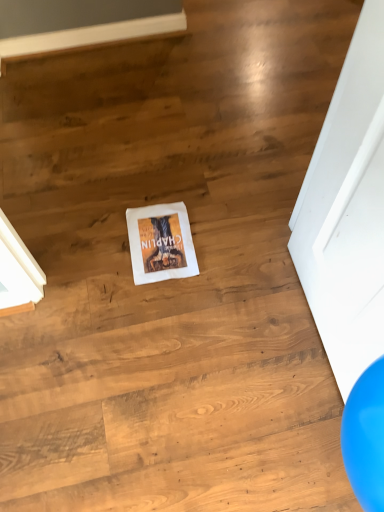
Question: Does white cloth at center have a smaller size compared to white matte door at center?

Choices:
 (A) no
 (B) yes

Answer: (B)

Question: From a real-world perspective, is white cloth at center positioned under white matte door at center based on gravity?

Choices:
 (A) yes
 (B) no

Answer: (A)

Question: Can you confirm if white cloth at center is positioned to the left of white matte door at center?

Choices:
 (A) yes
 (B) no

Answer: (A)

Question: Does white cloth at center have a lesser height compared to white matte door at center?

Choices:
 (A) no
 (B) yes

Answer: (B)

Question: Is white cloth at center facing away from white matte door at center?

Choices:
 (A) no
 (B) yes

Answer: (A)

Question: Is white cloth at center bigger than white matte door at center?

Choices:
 (A) yes
 (B) no

Answer: (B)

Question: From the image's perspective, is white matte door at center below white cloth at center?

Choices:
 (A) no
 (B) yes

Answer: (B)

Question: From a real-world perspective, is white matte door at center under white cloth at center?

Choices:
 (A) yes
 (B) no

Answer: (B)

Question: Does white matte door at center have a lesser height compared to white cloth at center?

Choices:
 (A) yes
 (B) no

Answer: (B)

Question: Can you confirm if white matte door at center is wider than white cloth at center?

Choices:
 (A) no
 (B) yes

Answer: (A)

Question: Are white matte door at center and white cloth at center making contact?

Choices:
 (A) yes
 (B) no

Answer: (B)

Question: Is white matte door at center positioned beyond the bounds of white cloth at center?

Choices:
 (A) yes
 (B) no

Answer: (A)

Question: Is white matte door at center bigger or smaller than white cloth at center?

Choices:
 (A) small
 (B) big

Answer: (B)